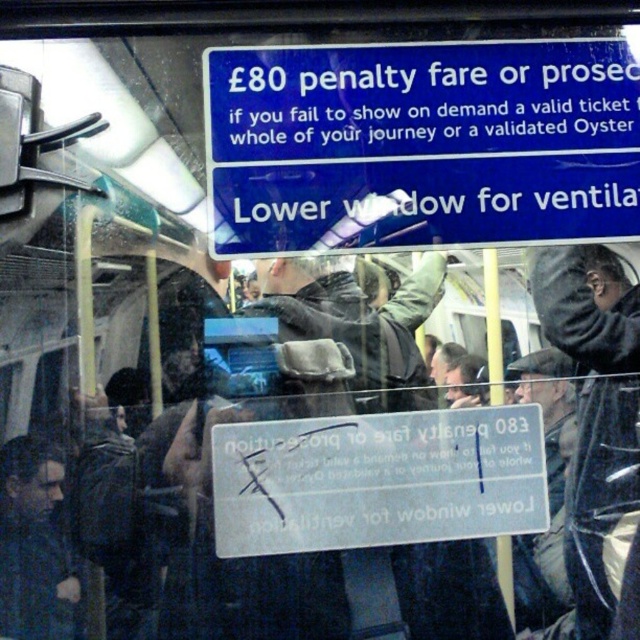
You are a passenger on the train and notice two signs on the window. The blue plastic sign at upper center and the white plastic sign at center. Which sign is wider?

The blue plastic sign at upper center is wider than the white plastic sign at center.